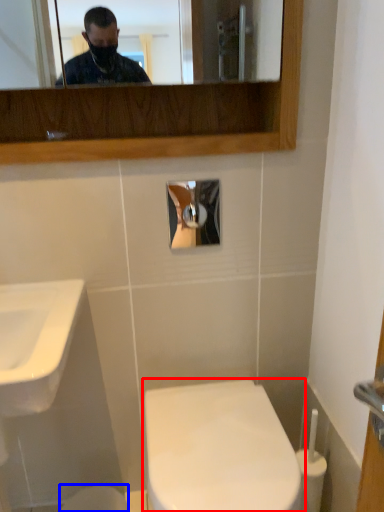
Question: Which of the following is the closest to the observer, toilet (highlighted by a red box) or toilet bowl (highlighted by a blue box)?

Choices:
 (A) toilet
 (B) toilet bowl

Answer: (A)